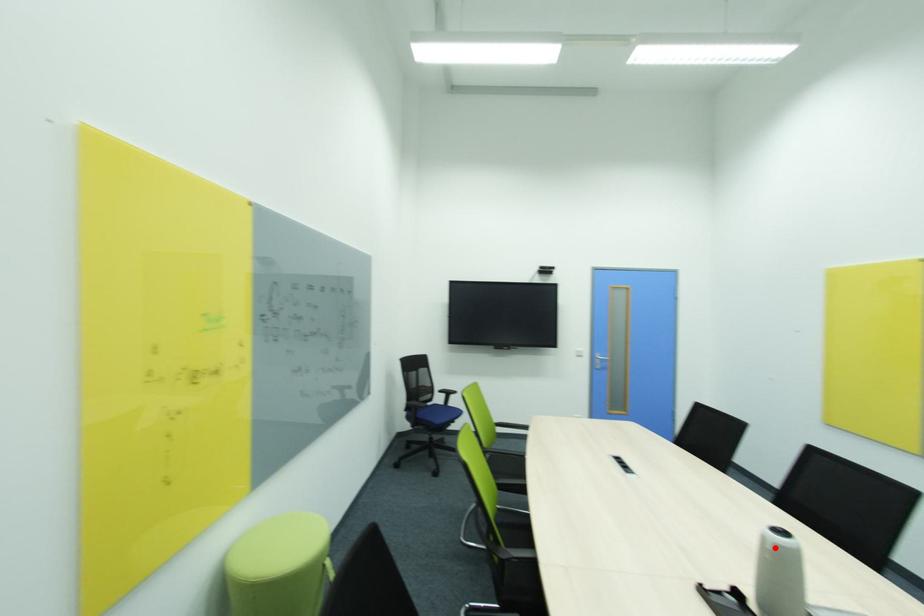
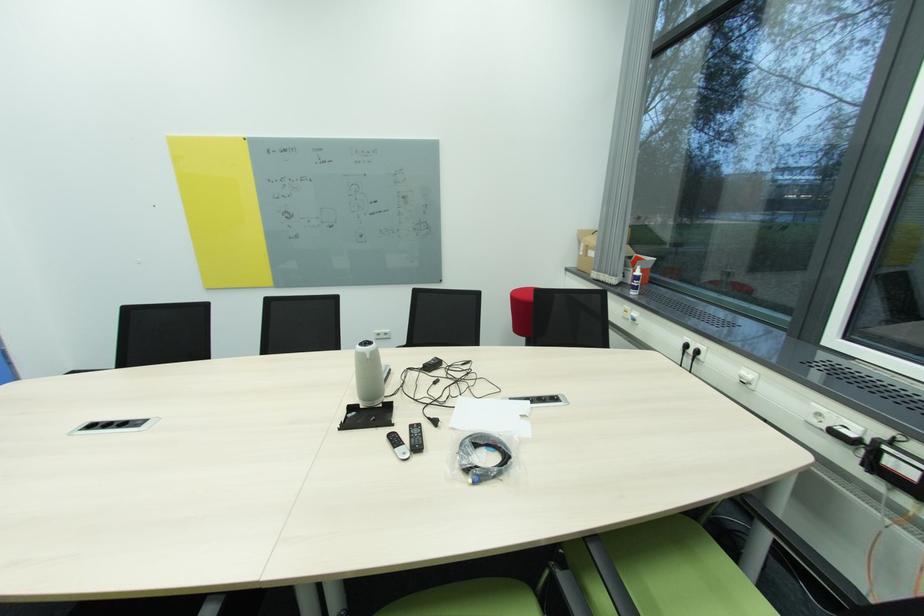
Question: I am providing you with two images of the same scene from different viewpoints. A red point is marked on the first image. At the location where the point appears in image 1, is it still visible in image 2?

Choices:
 (A) Yes
 (B) No

Answer: (A)